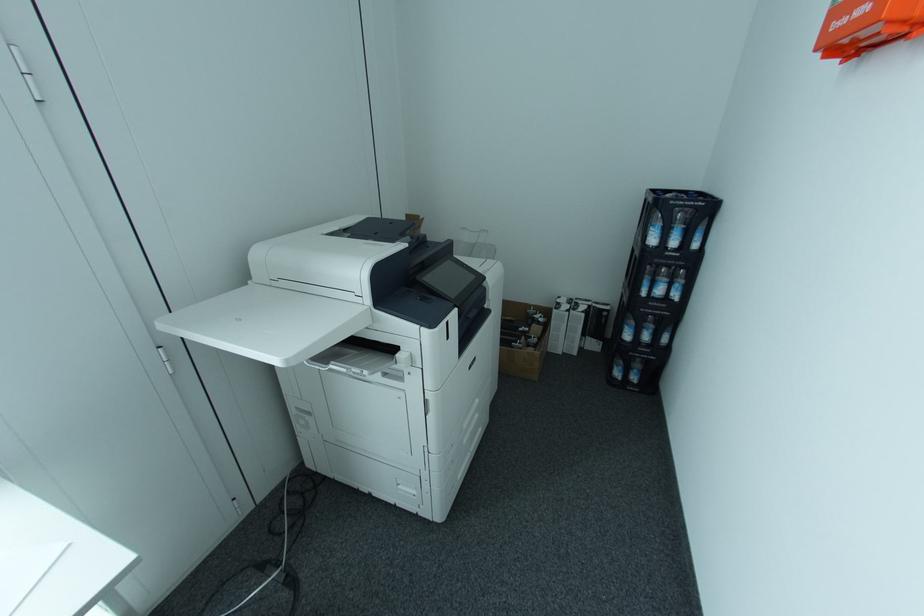
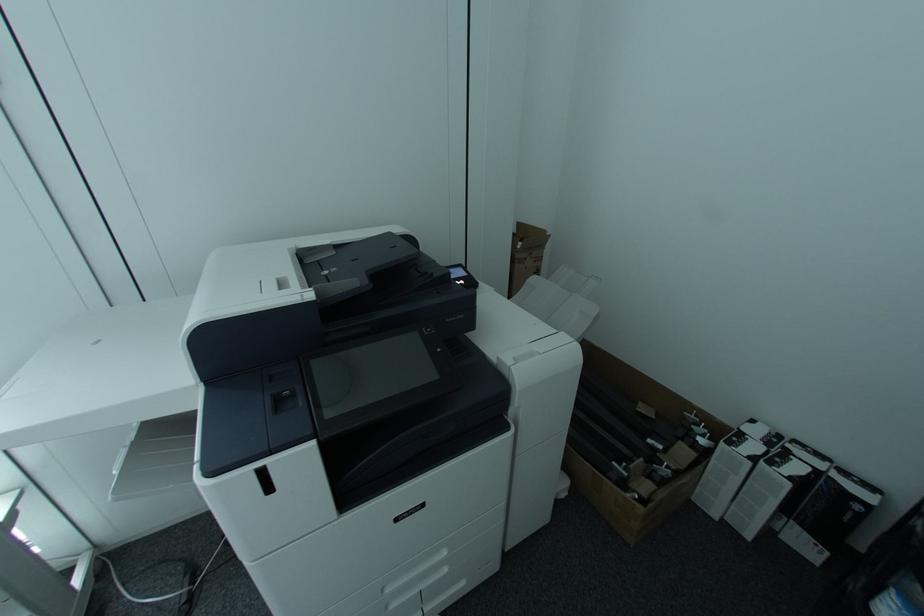
Question: Based on the continuous images, in which direction is the camera rotating? Reply with the corresponding letter.

Choices:
 (A) Left
 (B) Right
 (C) Up
 (D) Down

Answer: (A)